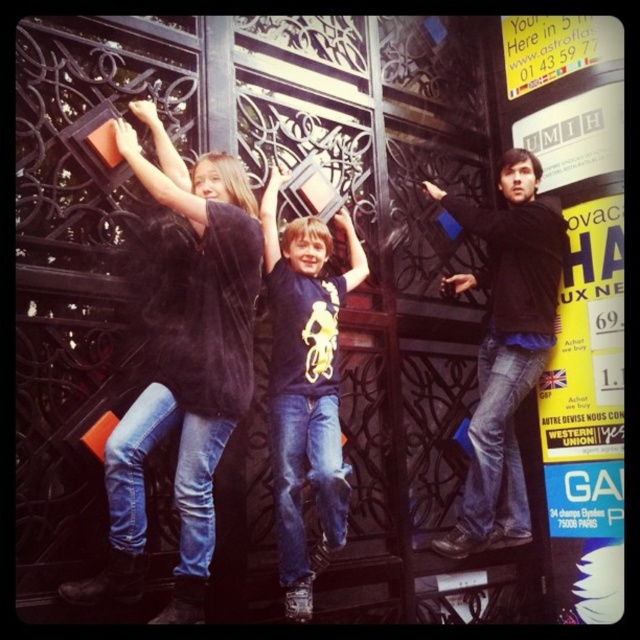
You are a fashion designer observing the image. You need to decide which clothing item, the velvet black coat at left or the matte black shirt at right, would require more fabric to make a similar garment. Which one would need more fabric?

The matte black shirt at right requires more fabric because its width is greater than the velvet black coat at left.

You are a fashion designer observing a photo shoot setup. You notice two pieces of clothing in the image. The first is the velvet black coat at left, and the second is the matte black shirt at right. Based on their positions in the image, which clothing item is covering part of the other?

The velvet black coat at left is positioned over the matte black shirt at right, so the velvet black coat at left is covering part of the matte black shirt at right.